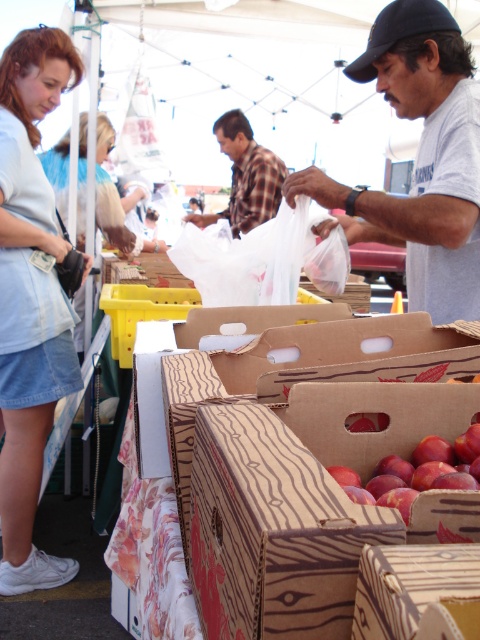
Question: Which point appears farthest from the camera in this image?

Choices:
 (A) (410, 35)
 (B) (224, 116)

Answer: (B)

Question: Can you confirm if gray t-shirt at center is thinner than plaid fabric shirt at center?

Choices:
 (A) yes
 (B) no

Answer: (A)

Question: Which object is positioned farthest from the gray t-shirt at center?

Choices:
 (A) black fabric baseball cap at upper right
 (B) denim skirt at left
 (C) wooden crate of apples at center
 (D) plaid fabric shirt at center

Answer: (D)

Question: Can you confirm if wooden crate of apples at center is positioned above gray t-shirt at center?

Choices:
 (A) yes
 (B) no

Answer: (B)

Question: Estimate the real-world distances between objects in this image. Which object is farther from the denim skirt at left?

Choices:
 (A) gray t-shirt at center
 (B) black fabric baseball cap at upper right
 (C) plaid fabric shirt at center
 (D) light blue denim skirt at lower left

Answer: (A)

Question: Can you confirm if light blue denim skirt at lower left is bigger than denim skirt at left?

Choices:
 (A) no
 (B) yes

Answer: (A)